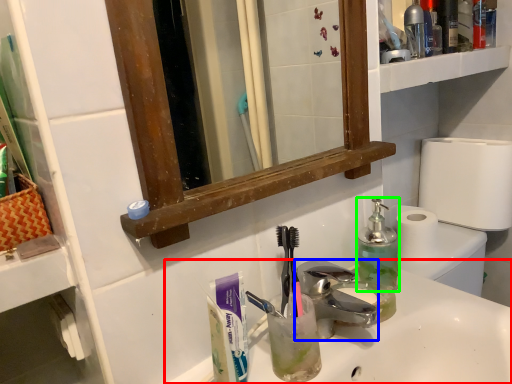
Question: Considering the real-world distances, which object is closest to sink (highlighted by a red box)? faucet (highlighted by a blue box) or bottle (highlighted by a green box).

Choices:
 (A) faucet
 (B) bottle

Answer: (A)